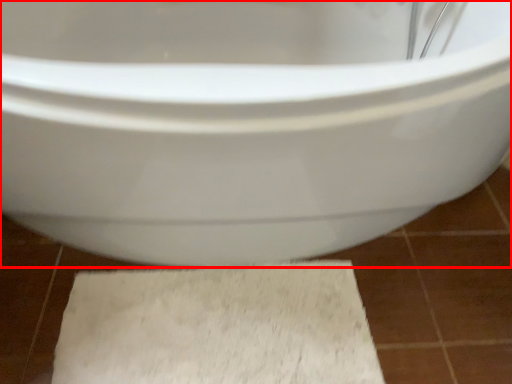
Question: In this image, where is toilet (annotated by the red box) located relative to bath mat?

Choices:
 (A) left
 (B) right

Answer: (B)